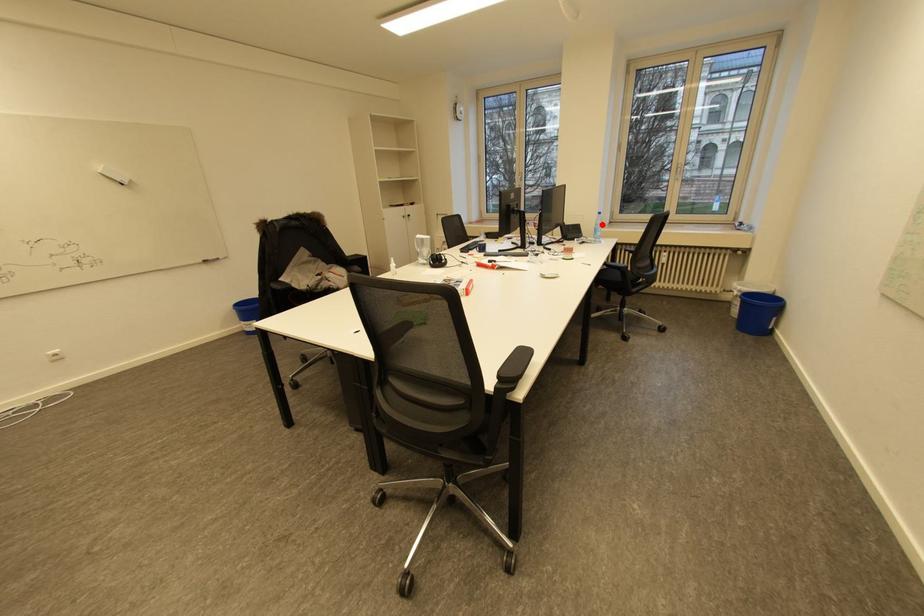
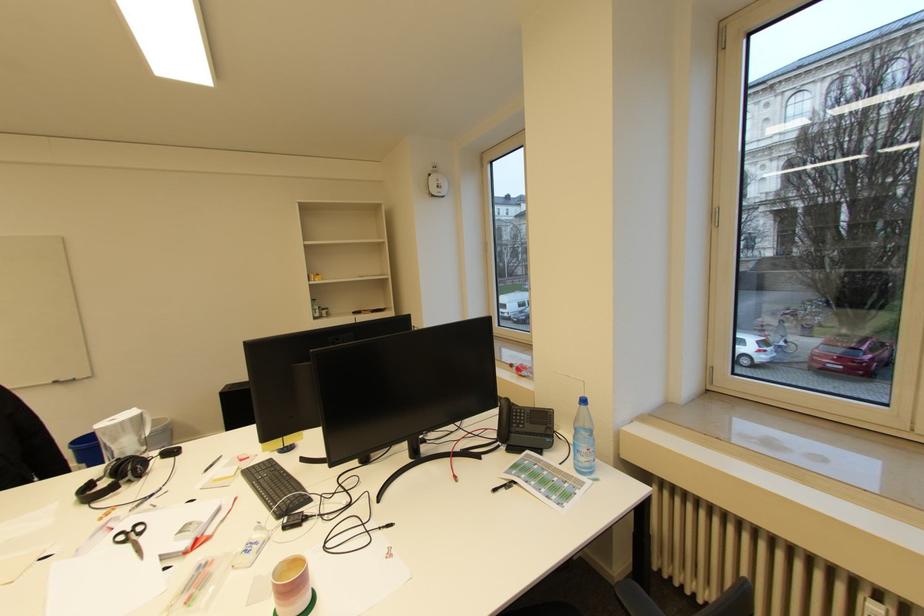
Question: I am providing you with two images of the same scene from different viewpoints. A red point is shown in image1. For the corresponding object point in image2, is it positioned nearer or farther from the camera?

Choices:
 (A) Nearer
 (B) Farther

Answer: (B)